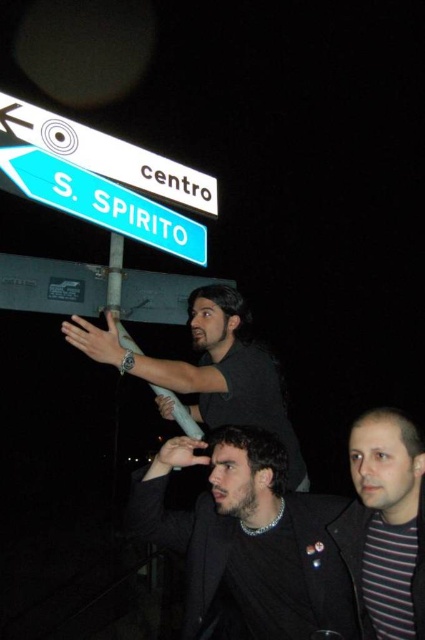
Question: Estimate the real-world distances between objects in this image. Which object is closer to the blue glossy street sign at upper left?

Choices:
 (A) black matte shirt at upper center
 (B) green plastic street sign at upper center
 (C) striped cotton shirt at lower right
 (D) dark brown leather jacket at center

Answer: (B)

Question: Which object appears closest to the camera in this image?

Choices:
 (A) dark brown leather jacket at center
 (B) striped cotton shirt at lower right
 (C) black matte shirt at upper center

Answer: (C)

Question: Does blue glossy street sign at upper left have a smaller size compared to green plastic street sign at upper center?

Choices:
 (A) yes
 (B) no

Answer: (A)

Question: Is black matte shirt at upper center to the left of blue glossy street sign at upper left from the viewer's perspective?

Choices:
 (A) yes
 (B) no

Answer: (B)

Question: From the image, what is the correct spatial relationship of striped cotton shirt at lower right in relation to black matte shirt at upper center?

Choices:
 (A) right
 (B) left

Answer: (A)

Question: Which object is the farthest from the dark brown leather jacket at center?

Choices:
 (A) striped cotton shirt at lower right
 (B) blue glossy street sign at upper left
 (C) black matte shirt at upper center
 (D) green plastic street sign at upper center

Answer: (D)